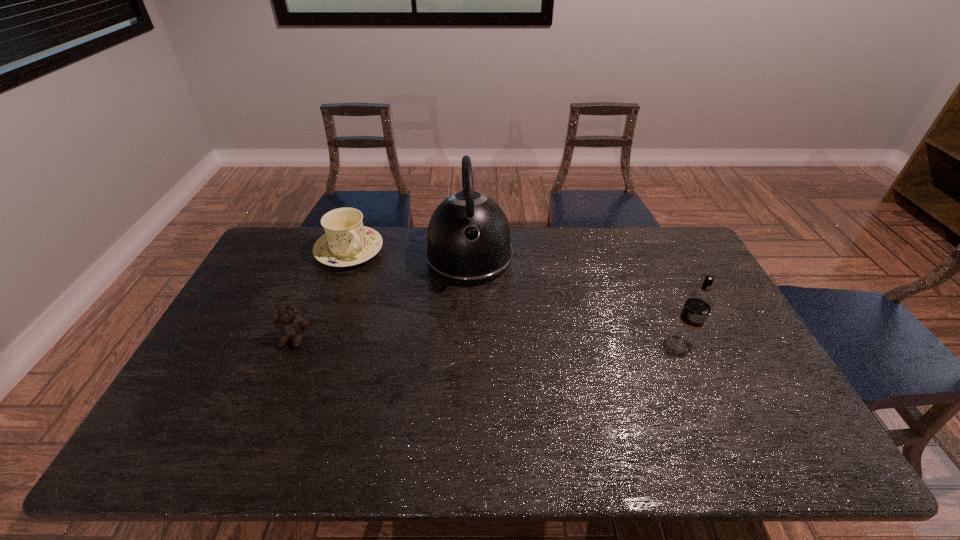
Locate an element on the screen. This screenshot has width=960, height=540. free space at the right edge of the desktop is located at coordinates (672, 289).

The width and height of the screenshot is (960, 540). Find the location of `free space at the far left corner`. free space at the far left corner is located at coordinates (276, 259).

This screenshot has height=540, width=960. In the image, there is a desktop. Find the location of `vacant space at the near left corner`. vacant space at the near left corner is located at coordinates (207, 413).

This screenshot has height=540, width=960. In order to click on free space at the far right corner of the desktop in this screenshot , I will do `click(665, 238)`.

You are a GUI agent. You are given a task and a screenshot of the screen. Output one action in this format:
    pyautogui.click(x=<x>, y=<y>)
    Task: Click on the free space at the near right corner
    This screenshot has width=960, height=540.
    Given the screenshot: What is the action you would take?
    coord(732,423)

At what (x,y) coordinates should I click in order to perform the action: click on free space between the rightmost object and the teddy bear. Please return your answer as a coordinate pair (x, y). The width and height of the screenshot is (960, 540). Looking at the image, I should click on (489, 340).

Image resolution: width=960 pixels, height=540 pixels. What are the coordinates of `empty space between the teddy bear and the tallest object` in the screenshot? It's located at (382, 298).

The height and width of the screenshot is (540, 960). Identify the location of vacant space in between the teddy bear and the vodka. (489, 340).

I want to click on free point between the rightmost object and the tallest object, so click(576, 299).

In order to click on vacant area that lies between the teddy bear and the vodka in this screenshot , I will do `click(489, 340)`.